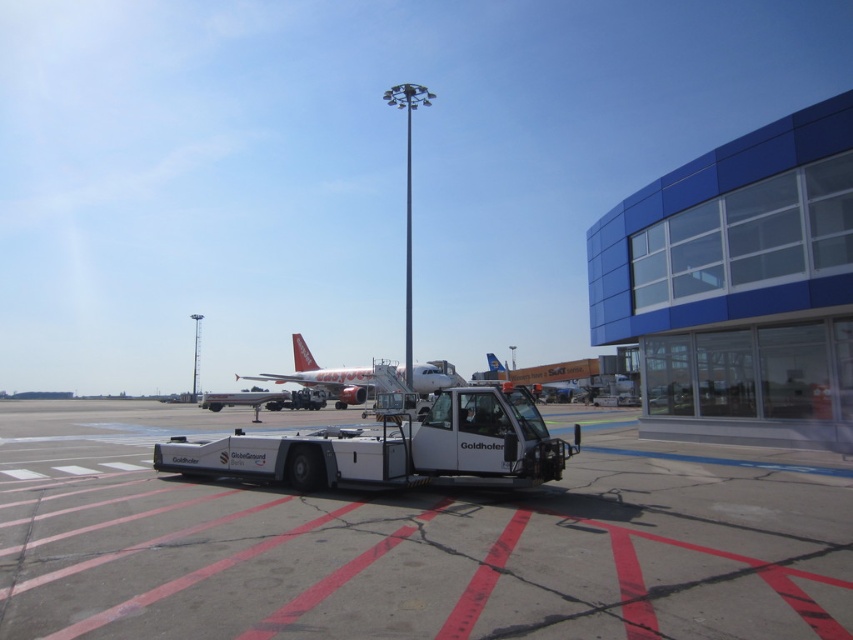
You are an airport maintenance worker needing to move the white matte tow truck at center and the matte red airplane at center to a different area. Based on their widths, which one might be easier to maneuver through narrow pathways?

The white matte tow truck at center is thinner than the matte red airplane at center, so it would be easier to maneuver through narrow pathways.

You are a ground crew member who needs to move the white matte tow truck at center to another location. Given that the tow truck requires a minimum of 60 feet of space to maneuver safely, can you safely move it without getting too close to the matte red airplane at center?

The white matte tow truck at center and the matte red airplane at center are 62.73 feet apart from each other. Since the tow truck requires a minimum of 60 feet of space to maneuver safely, the current distance of 62.73 feet is sufficient, so yes, it can be moved safely without getting too close to the matte red airplane at center.